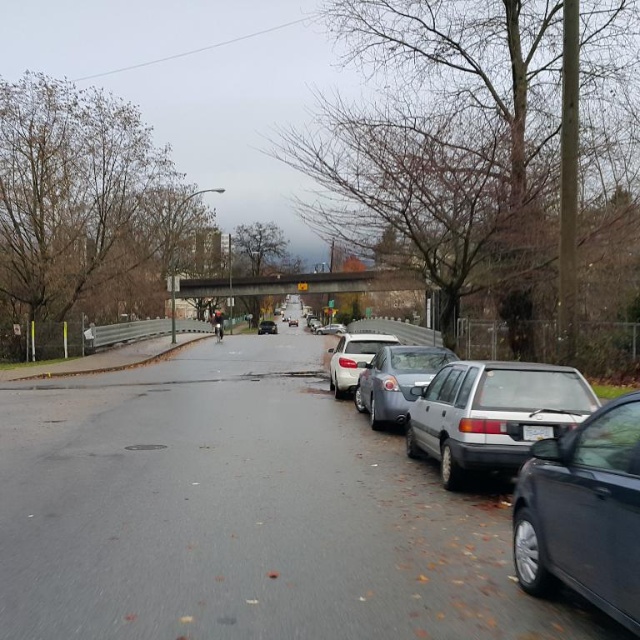
You are a delivery drone operator. Your drone needs to fly under the concrete bridge at center to deliver a package. The drone is 1.5 meters tall. Can it safely pass under the bridge without hitting the silver metallic sedan at center?

The concrete bridge at center is much taller than the silver metallic sedan at center, so the drone can safely pass under the bridge since the bridge is taller than the sedan and the drone is only 1.5 meters tall.

From the picture: You are a delivery person who needs to attach a rectangular sticker to either the white plastic license plate at center or the shiny silver sedan at center. The sticker is 10 cm wide. Which object can the sticker fit on without overlapping the edges?

The sticker can fit on the shiny silver sedan at center because the white plastic license plate at center is thinner than the shiny silver sedan at center, so the sedan has a wider surface to accommodate the 10 cm wide sticker without overlapping the edges.

You are a delivery person with a cart that is 4 feet wide. You are standing at the start of the road and want to reach the concrete bridge at center. Is there enough space between the parked cars on the right and the cyclist on the left to move your cart straight ahead?

The concrete bridge at center is 60.59 feet away from the viewer. Since the delivery person needs to move straight ahead towards the bridge, the distance is sufficient. However, the question about space between parked cars and the cyclist isn